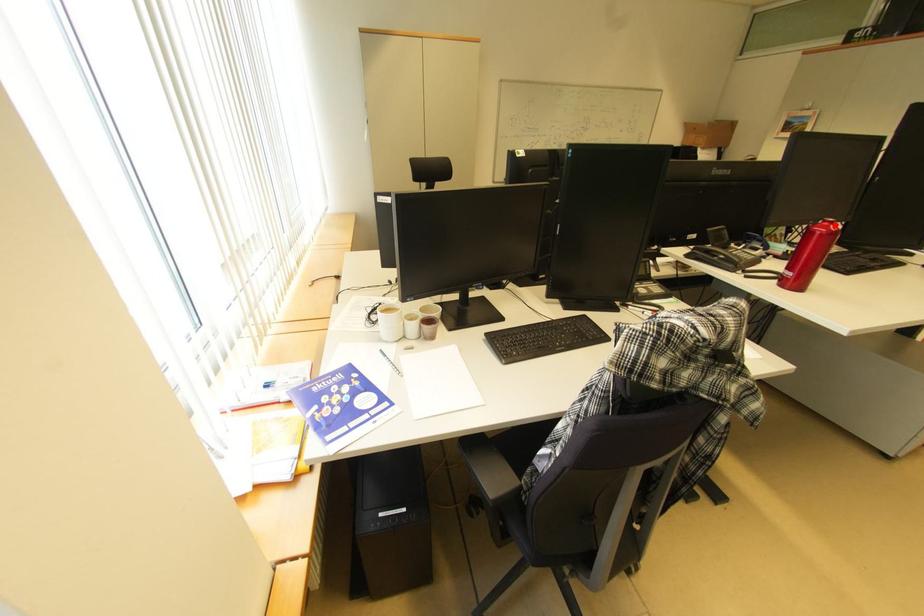
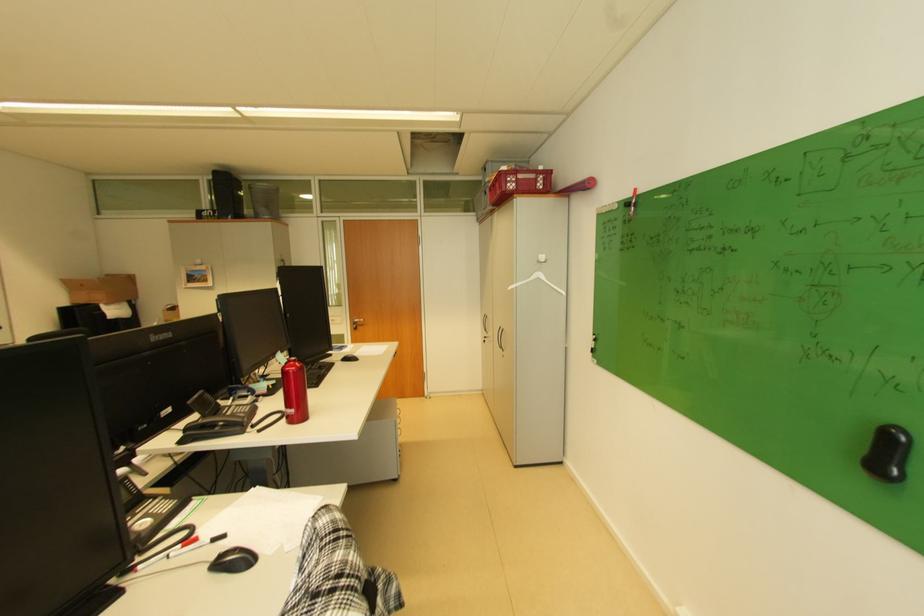
Locate, in the second image, the point that corresponds to the highlighted location in the first image.

(301, 363)